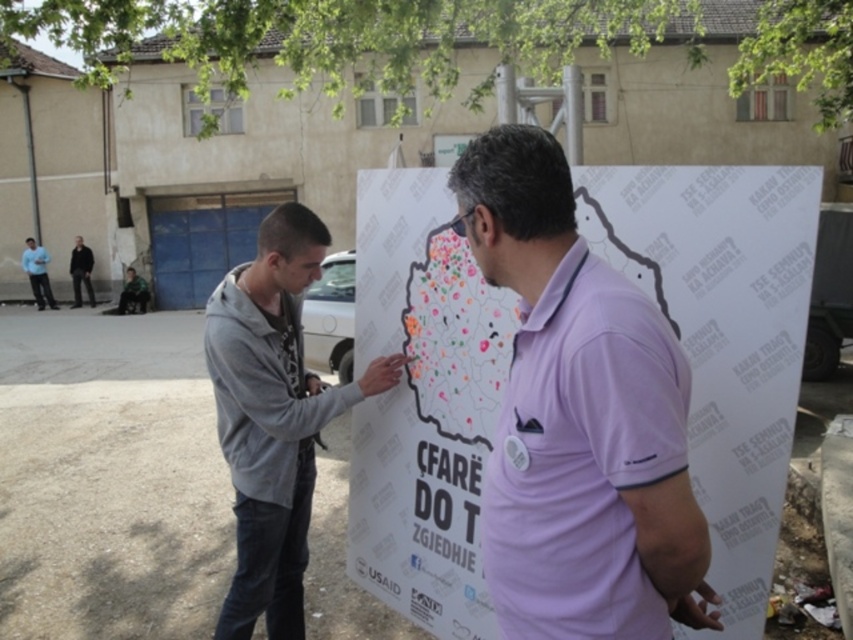
You are a photographer trying to capture a clear shot of both the purple cotton polo shirt at center and the gray fleece jacket at center in the scene. Since you want both subjects to appear equally sized in the photo, which adjustment should you make based on their current sizes?

The purple cotton polo shirt at center is bigger than the gray fleece jacket at center. To make them appear equally sized in the photo, you should move closer to the gray fleece jacket at center or move further away from the purple cotton polo shirt at center.

What are the coordinates of the purple cotton polo shirt at center?

The purple cotton polo shirt at center is located at coordinates point (x=578, y=419).

You are a tour guide leading a group through the area and need to ensure that a 1.5 meter social distancing rule is maintained between visitors. You observe two people wearing the purple cotton polo shirt at center and the gray fleece jacket at center. Can they remain in their current positions without violating the rule?

The distance between the purple cotton polo shirt at center and the gray fleece jacket at center is 1.25 meters, which is less than the required 1.5 meters. Therefore, they need to move further apart to comply with the social distancing rule.